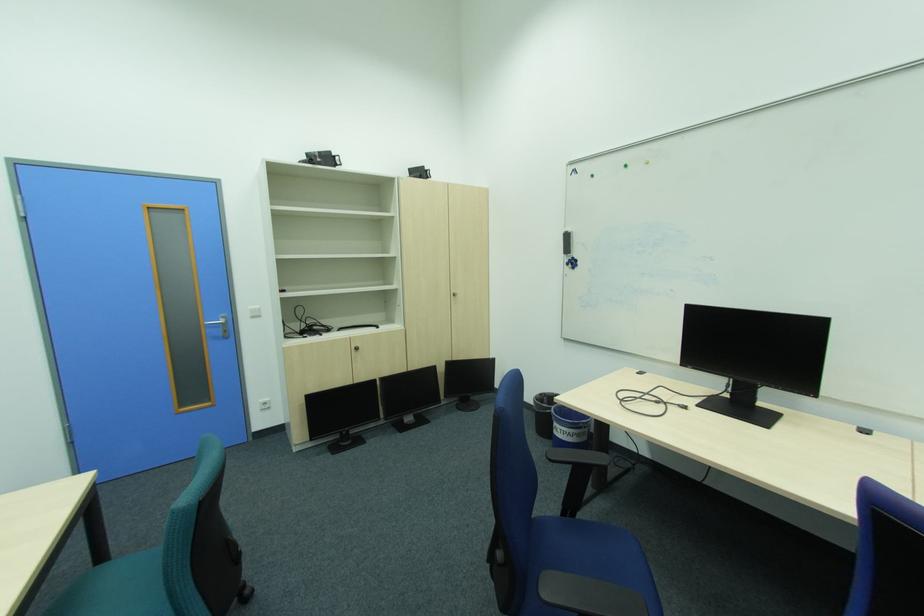
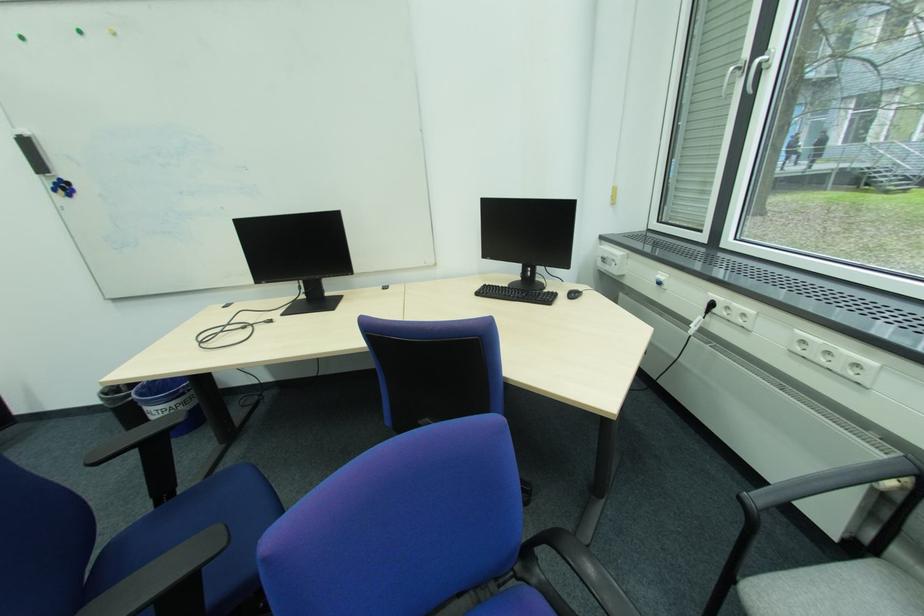
The images are taken continuously from a first-person perspective. In which direction is your viewpoint rotating?

The rotation direction of the camera is right-down.